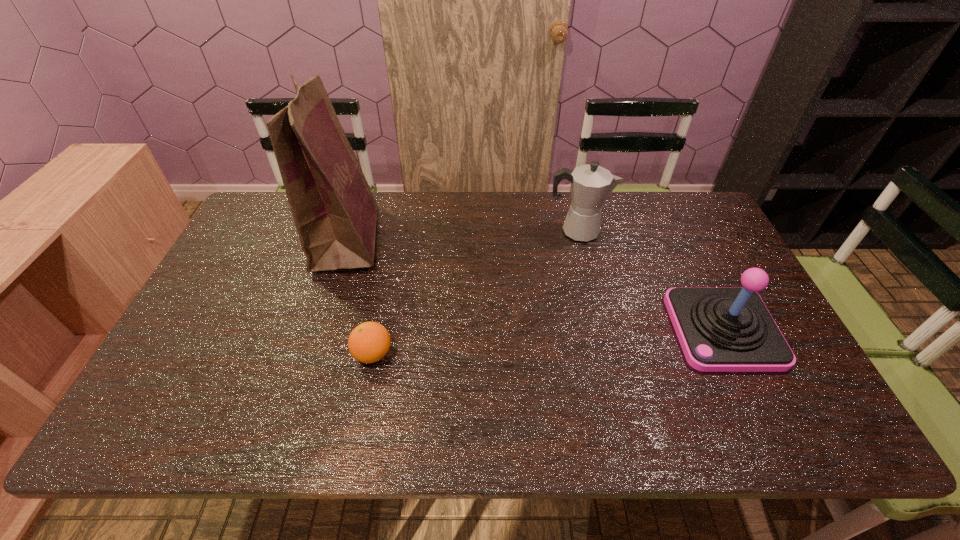
Where is `vacant space situated on the right of the shortest object`? vacant space situated on the right of the shortest object is located at coordinates (538, 354).

Image resolution: width=960 pixels, height=540 pixels. I want to click on grocery bag that is positioned at the far edge, so click(x=335, y=213).

Where is `coffeepot positioned at the far edge`? coffeepot positioned at the far edge is located at coordinates (591, 184).

The height and width of the screenshot is (540, 960). In order to click on object present at the right edge in this screenshot , I will do `click(719, 329)`.

In the image, there is a desktop. Find the location of `vacant space at the far edge`. vacant space at the far edge is located at coordinates (418, 196).

In the image, there is a desktop. In order to click on free space at the near edge in this screenshot , I will do `click(302, 414)`.

Where is `free location at the left edge of the desktop`? free location at the left edge of the desktop is located at coordinates (183, 353).

Where is `vacant space at the near left corner`? vacant space at the near left corner is located at coordinates (186, 434).

Where is `vacant area at the near right corner`? The image size is (960, 540). vacant area at the near right corner is located at coordinates (806, 433).

You are a GUI agent. You are given a task and a screenshot of the screen. Output one action in this format:
    pyautogui.click(x=<x>, y=<y>)
    Task: Click on the free space that is in between the tallest object and the second shortest object
    This screenshot has height=540, width=960.
    Given the screenshot: What is the action you would take?
    pyautogui.click(x=535, y=284)